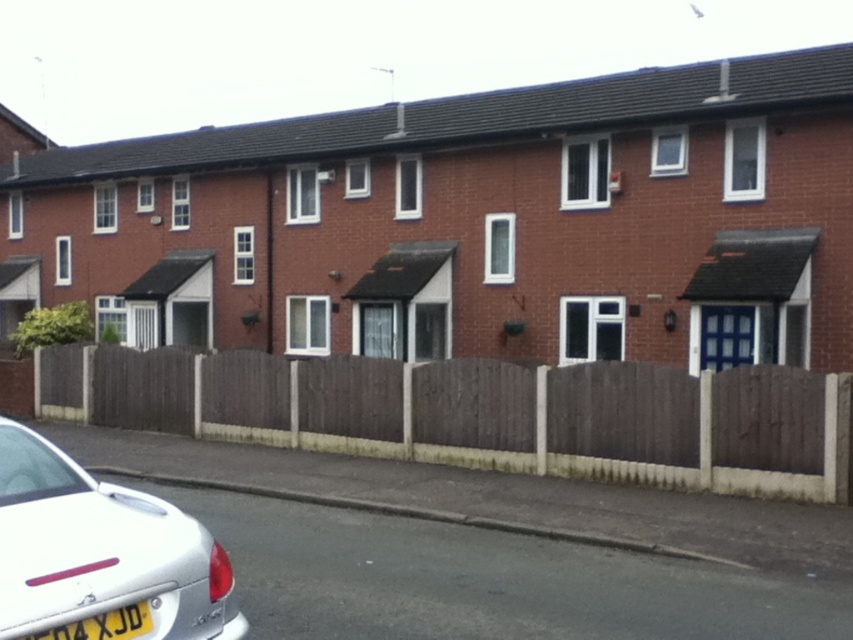
Question: Can you confirm if white glossy car at lower left is positioned to the left of yellow plastic license plate at lower left?

Choices:
 (A) no
 (B) yes

Answer: (B)

Question: From the image, what is the correct spatial relationship of white glossy car at lower left in relation to yellow plastic license plate at lower left?

Choices:
 (A) right
 (B) left

Answer: (B)

Question: Among these objects, which one is farthest from the camera?

Choices:
 (A) brown wooden fence at lower left
 (B) white glossy car at lower left
 (C) yellow plastic license plate at lower left

Answer: (A)

Question: Is brown wooden fence at lower left bigger than yellow plastic license plate at lower left?

Choices:
 (A) yes
 (B) no

Answer: (A)

Question: Which point appears farthest from the camera in this image?

Choices:
 (A) (148, 362)
 (B) (215, 592)
 (C) (113, 637)

Answer: (A)

Question: Among these objects, which one is farthest from the camera?

Choices:
 (A) brown wooden fence at lower left
 (B) yellow plastic license plate at lower left

Answer: (A)